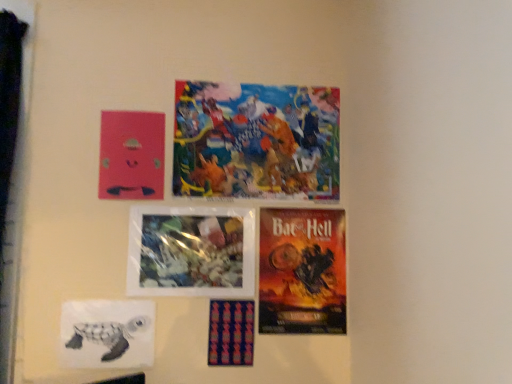
What is the approximate width of colorful collage at upper center, the first poster viewed from the top?

colorful collage at upper center, the first poster viewed from the top, is 0.62 inches in width.

Where is `colorful collage at upper center, marked as the sixth poster in a bottom-to-top arrangement`? colorful collage at upper center, marked as the sixth poster in a bottom-to-top arrangement is located at coordinates (256, 141).

At what (x,y) coordinates should I click in order to perform the action: click on white paper turtle at lower left, which is counted as the fifth poster, starting from the top. Please return your answer as a coordinate pair (x, y). The image size is (512, 384). Looking at the image, I should click on (106, 334).

This screenshot has height=384, width=512. Describe the element at coordinates (302, 271) in the screenshot. I see `orange matte poster at lower right, positioned as the 4th poster in top-to-bottom order` at that location.

Identify the location of colorful collage at upper center, the first poster viewed from the top. (256, 141).

Considering the sizes of objects orange matte poster at lower right, acting as the 3th poster starting from the bottom, and white paper turtle at lower left, which is counted as the fifth poster, starting from the top, in the image provided, who is bigger, orange matte poster at lower right, acting as the 3th poster starting from the bottom, or white paper turtle at lower left, which is counted as the fifth poster, starting from the top,?

With larger size is orange matte poster at lower right, acting as the 3th poster starting from the bottom.

Does orange matte poster at lower right, acting as the 3th poster starting from the bottom, have a lesser width compared to white paper turtle at lower left, which is counted as the fifth poster, starting from the top?

No, orange matte poster at lower right, acting as the 3th poster starting from the bottom, is not thinner than white paper turtle at lower left, which is counted as the fifth poster, starting from the top.

Can you confirm if orange matte poster at lower right, positioned as the 4th poster in top-to-bottom order, is shorter than white paper turtle at lower left, which is the 2th poster in bottom-to-top order?

No, orange matte poster at lower right, positioned as the 4th poster in top-to-bottom order, is not shorter than white paper turtle at lower left, which is the 2th poster in bottom-to-top order.

Is pink matte poster at upper left, acting as the second poster starting from the top, facing away from translucent plastic flowers at center, the third poster when ordered from top to bottom?

No, pink matte poster at upper left, acting as the second poster starting from the top, is not facing the opposite direction of translucent plastic flowers at center, the third poster when ordered from top to bottom.

Is pink matte poster at upper left, acting as the second poster starting from the top, inside the boundaries of translucent plastic flowers at center, which ranks as the 4th poster in bottom-to-top order, or outside?

pink matte poster at upper left, acting as the second poster starting from the top, cannot be found inside translucent plastic flowers at center, which ranks as the 4th poster in bottom-to-top order.

From a real-world perspective, which is physically below, pink matte poster at upper left, acting as the second poster starting from the top, or translucent plastic flowers at center, the third poster when ordered from top to bottom?

From a 3D spatial view, translucent plastic flowers at center, the third poster when ordered from top to bottom, is below.

Locate an element on the screen. Image resolution: width=512 pixels, height=384 pixels. the 2nd poster in front of the pink matte poster at upper left, acting as the second poster starting from the top, counting from the anchor's position is located at coordinates (191, 251).

Considering the relative positions of textured fabric poster at center, the sixth poster from the top, and orange matte poster at lower right, positioned as the 4th poster in top-to-bottom order, in the image provided, is textured fabric poster at center, the sixth poster from the top, in front of orange matte poster at lower right, positioned as the 4th poster in top-to-bottom order,?

Yes, textured fabric poster at center, the sixth poster from the top, is in front of orange matte poster at lower right, positioned as the 4th poster in top-to-bottom order.

Is textured fabric poster at center, the sixth poster from the top, positioned beyond the bounds of orange matte poster at lower right, positioned as the 4th poster in top-to-bottom order?

Indeed, textured fabric poster at center, the sixth poster from the top, is completely outside orange matte poster at lower right, positioned as the 4th poster in top-to-bottom order.

From the image's perspective, is textured fabric poster at center, the sixth poster from the top, above or below orange matte poster at lower right, positioned as the 4th poster in top-to-bottom order?

textured fabric poster at center, the sixth poster from the top, is situated lower than orange matte poster at lower right, positioned as the 4th poster in top-to-bottom order, in the image.

Is textured fabric poster at center, marked as the 1th poster in a bottom-to-top arrangement, wider or thinner than orange matte poster at lower right, acting as the 3th poster starting from the bottom?

textured fabric poster at center, marked as the 1th poster in a bottom-to-top arrangement, is wider than orange matte poster at lower right, acting as the 3th poster starting from the bottom.

From a real-world perspective, is orange matte poster at lower right, positioned as the 4th poster in top-to-bottom order, on top of textured fabric poster at center, the sixth poster from the top?

Indeed, from a real-world perspective, orange matte poster at lower right, positioned as the 4th poster in top-to-bottom order, stands above textured fabric poster at center, the sixth poster from the top.

How many degrees apart are the facing directions of orange matte poster at lower right, acting as the 3th poster starting from the bottom, and textured fabric poster at center, the sixth poster from the top?

orange matte poster at lower right, acting as the 3th poster starting from the bottom, and textured fabric poster at center, the sixth poster from the top, are facing 0.00378 degrees away from each other.

Could you measure the distance between orange matte poster at lower right, positioned as the 4th poster in top-to-bottom order, and textured fabric poster at center, marked as the 1th poster in a bottom-to-top arrangement?

orange matte poster at lower right, positioned as the 4th poster in top-to-bottom order, is 20.48 centimeters from textured fabric poster at center, marked as the 1th poster in a bottom-to-top arrangement.

From the image's perspective, is orange matte poster at lower right, positioned as the 4th poster in top-to-bottom order, located above or below textured fabric poster at center, the sixth poster from the top?

orange matte poster at lower right, positioned as the 4th poster in top-to-bottom order, is above textured fabric poster at center, the sixth poster from the top.

Is pink matte poster at upper left, acting as the second poster starting from the top, positioned far away from colorful collage at upper center, the first poster viewed from the top?

pink matte poster at upper left, acting as the second poster starting from the top, is actually quite close to colorful collage at upper center, the first poster viewed from the top.

Is pink matte poster at upper left, which is counted as the 5th poster, starting from the bottom, in front of colorful collage at upper center, the first poster viewed from the top?

Yes, pink matte poster at upper left, which is counted as the 5th poster, starting from the bottom, is closer to the camera.

Between pink matte poster at upper left, acting as the second poster starting from the top, and colorful collage at upper center, marked as the sixth poster in a bottom-to-top arrangement, which one appears on the right side from the viewer's perspective?

Positioned to the right is colorful collage at upper center, marked as the sixth poster in a bottom-to-top arrangement.

From the image's perspective, is pink matte poster at upper left, acting as the second poster starting from the top, positioned above or below colorful collage at upper center, the first poster viewed from the top?

Based on their image positions, pink matte poster at upper left, acting as the second poster starting from the top, is located beneath colorful collage at upper center, the first poster viewed from the top.

From a real-world perspective, is white paper turtle at lower left, which is counted as the fifth poster, starting from the top, below colorful collage at upper center, the first poster viewed from the top?

Yes, from a real-world perspective, white paper turtle at lower left, which is counted as the fifth poster, starting from the top, is under colorful collage at upper center, the first poster viewed from the top.

Can we say white paper turtle at lower left, which is counted as the fifth poster, starting from the top, lies outside colorful collage at upper center, the first poster viewed from the top?

Yes, white paper turtle at lower left, which is counted as the fifth poster, starting from the top, is located beyond the bounds of colorful collage at upper center, the first poster viewed from the top.

Who is smaller, white paper turtle at lower left, which is the 2th poster in bottom-to-top order, or colorful collage at upper center, marked as the sixth poster in a bottom-to-top arrangement?

white paper turtle at lower left, which is the 2th poster in bottom-to-top order.

Are white paper turtle at lower left, which is the 2th poster in bottom-to-top order, and colorful collage at upper center, marked as the sixth poster in a bottom-to-top arrangement, beside each other?

There is a gap between white paper turtle at lower left, which is the 2th poster in bottom-to-top order, and colorful collage at upper center, marked as the sixth poster in a bottom-to-top arrangement.

Is point (337, 126) farther from camera compared to point (244, 361)?

That is True.

How different are the orientations of colorful collage at upper center, the first poster viewed from the top, and textured fabric poster at center, the sixth poster from the top, in degrees?

The angle between the facing direction of colorful collage at upper center, the first poster viewed from the top, and the facing direction of textured fabric poster at center, the sixth poster from the top, is 0.0547 degrees.

From the image's perspective, is colorful collage at upper center, marked as the sixth poster in a bottom-to-top arrangement, under textured fabric poster at center, marked as the 1th poster in a bottom-to-top arrangement?

No, from the image's perspective, colorful collage at upper center, marked as the sixth poster in a bottom-to-top arrangement, is not beneath textured fabric poster at center, marked as the 1th poster in a bottom-to-top arrangement.

Is colorful collage at upper center, marked as the sixth poster in a bottom-to-top arrangement, in contact with textured fabric poster at center, the sixth poster from the top?

colorful collage at upper center, marked as the sixth poster in a bottom-to-top arrangement, and textured fabric poster at center, the sixth poster from the top, are clearly separated.

Starting from the orange matte poster at lower right, positioned as the 4th poster in top-to-bottom order, which poster is the 5th one to the left? Please provide its 2D coordinates.

[(106, 334)]

This screenshot has width=512, height=384. I want to click on the 2nd poster in front of the pink matte poster at upper left, which is counted as the 5th poster, starting from the bottom, so click(191, 251).

From the image, which object appears to be farther from translucent plastic flowers at center, the third poster when ordered from top to bottom, orange matte poster at lower right, positioned as the 4th poster in top-to-bottom order, or colorful collage at upper center, the first poster viewed from the top?

The object further to translucent plastic flowers at center, the third poster when ordered from top to bottom, is colorful collage at upper center, the first poster viewed from the top.

From the picture: Which object lies nearer to the anchor point textured fabric poster at center, marked as the 1th poster in a bottom-to-top arrangement, orange matte poster at lower right, acting as the 3th poster starting from the bottom, or colorful collage at upper center, marked as the sixth poster in a bottom-to-top arrangement?

The object closer to textured fabric poster at center, marked as the 1th poster in a bottom-to-top arrangement, is orange matte poster at lower right, acting as the 3th poster starting from the bottom.

Considering their positions, is white paper turtle at lower left, which is the 2th poster in bottom-to-top order, positioned closer to colorful collage at upper center, the first poster viewed from the top, than orange matte poster at lower right, acting as the 3th poster starting from the bottom?

orange matte poster at lower right, acting as the 3th poster starting from the bottom.

Looking at the image, which one is located closer to white paper turtle at lower left, which is the 2th poster in bottom-to-top order, pink matte poster at upper left, which is counted as the 5th poster, starting from the bottom, or translucent plastic flowers at center, which ranks as the 4th poster in bottom-to-top order?

Based on the image, translucent plastic flowers at center, which ranks as the 4th poster in bottom-to-top order, appears to be nearer to white paper turtle at lower left, which is the 2th poster in bottom-to-top order.

From the image, which object appears to be nearer to translucent plastic flowers at center, the third poster when ordered from top to bottom, white paper turtle at lower left, which is counted as the fifth poster, starting from the top, or orange matte poster at lower right, positioned as the 4th poster in top-to-bottom order?

The object closer to translucent plastic flowers at center, the third poster when ordered from top to bottom, is orange matte poster at lower right, positioned as the 4th poster in top-to-bottom order.

In the scene shown: Estimate the real-world distances between objects in this image. Which object is closer to white paper turtle at lower left, which is counted as the fifth poster, starting from the top, textured fabric poster at center, the sixth poster from the top, or colorful collage at upper center, the first poster viewed from the top?

textured fabric poster at center, the sixth poster from the top.

From the image, which object appears to be farther from translucent plastic flowers at center, which ranks as the 4th poster in bottom-to-top order, colorful collage at upper center, the first poster viewed from the top, or white paper turtle at lower left, which is counted as the fifth poster, starting from the top?

colorful collage at upper center, the first poster viewed from the top.

When comparing their distances from white paper turtle at lower left, which is the 2th poster in bottom-to-top order, does translucent plastic flowers at center, which ranks as the 4th poster in bottom-to-top order, or textured fabric poster at center, marked as the 1th poster in a bottom-to-top arrangement, seem further?

textured fabric poster at center, marked as the 1th poster in a bottom-to-top arrangement, is further to white paper turtle at lower left, which is the 2th poster in bottom-to-top order.